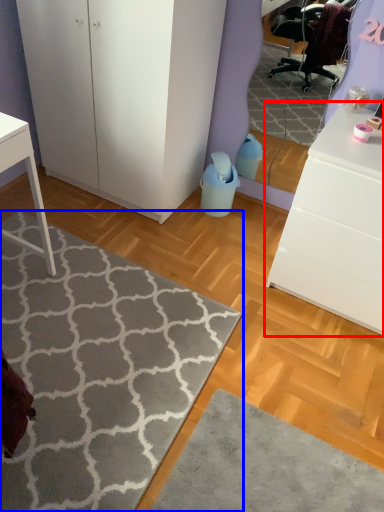
Question: Which object appears farthest to the camera in this image, chest of drawers (highlighted by a red box) or doormat (highlighted by a blue box)?

Choices:
 (A) chest of drawers
 (B) doormat

Answer: (A)